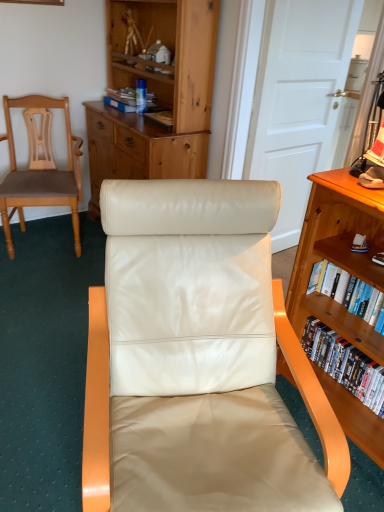
Question: Is white wood door at upper center next to satin white leather chair at center, the 1th chair in the front-to-back sequence?

Choices:
 (A) no
 (B) yes

Answer: (A)

Question: Does white wood door at upper center have a lesser width compared to satin white leather chair at center, the 1th chair in the front-to-back sequence?

Choices:
 (A) no
 (B) yes

Answer: (B)

Question: Is white wood door at upper center bigger than satin white leather chair at center, the first chair positioned from the right?

Choices:
 (A) yes
 (B) no

Answer: (B)

Question: Is white wood door at upper center in front of satin white leather chair at center, the 1th chair in the front-to-back sequence?

Choices:
 (A) yes
 (B) no

Answer: (B)

Question: From a real-world perspective, is white wood door at upper center below satin white leather chair at center, the first chair positioned from the right?

Choices:
 (A) no
 (B) yes

Answer: (A)

Question: From the image's perspective, is white wood door at upper center above satin white leather chair at center, the first chair positioned from the right?

Choices:
 (A) yes
 (B) no

Answer: (A)

Question: Does white wood door at upper center have a larger size compared to metallic silver lamp at upper right?

Choices:
 (A) no
 (B) yes

Answer: (B)

Question: Is metallic silver lamp at upper right inside white wood door at upper center?

Choices:
 (A) yes
 (B) no

Answer: (B)

Question: From the image's perspective, does white wood door at upper center appear higher than metallic silver lamp at upper right?

Choices:
 (A) yes
 (B) no

Answer: (A)

Question: Is white wood door at upper center further to camera compared to metallic silver lamp at upper right?

Choices:
 (A) no
 (B) yes

Answer: (B)

Question: Does white wood door at upper center have a lesser height compared to metallic silver lamp at upper right?

Choices:
 (A) no
 (B) yes

Answer: (A)

Question: Is white wood door at upper center looking in the opposite direction of metallic silver lamp at upper right?

Choices:
 (A) no
 (B) yes

Answer: (A)

Question: Can you confirm if white wood door at upper center is bigger than matte cardboard book at upper center, positioned as the first book in top-to-bottom order?

Choices:
 (A) no
 (B) yes

Answer: (B)